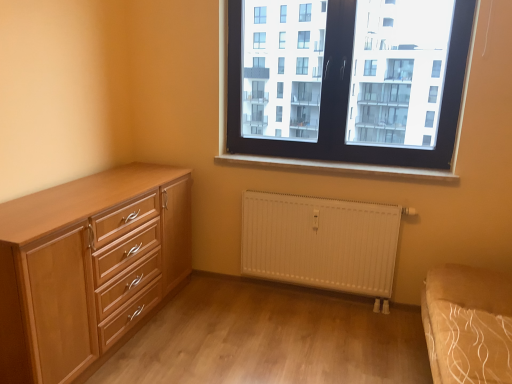
Question: Would you say white painted wood at center is to the left or to the right of black plastic window at upper center in the picture?

Choices:
 (A) left
 (B) right

Answer: (A)

Question: Considering their positions, is white painted wood at center located in front of or behind black plastic window at upper center?

Choices:
 (A) behind
 (B) front

Answer: (A)

Question: Estimate the real-world distances between objects in this image. Which object is farther from the white painted wood at center?

Choices:
 (A) light wood chest of drawers at left
 (B) white matte radiator at lower center
 (C) black plastic window at upper center

Answer: (A)

Question: Estimate the real-world distances between objects in this image. Which object is closer to the white matte radiator at lower center?

Choices:
 (A) white painted wood at center
 (B) black plastic window at upper center
 (C) light wood chest of drawers at left

Answer: (A)